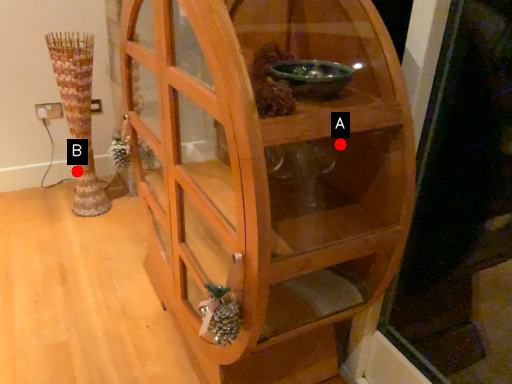
Question: Two points are circled on the image, labeled by A and B beside each circle. Which point is farther from the camera taking this photo?

Choices:
 (A) A is further
 (B) B is further

Answer: (B)